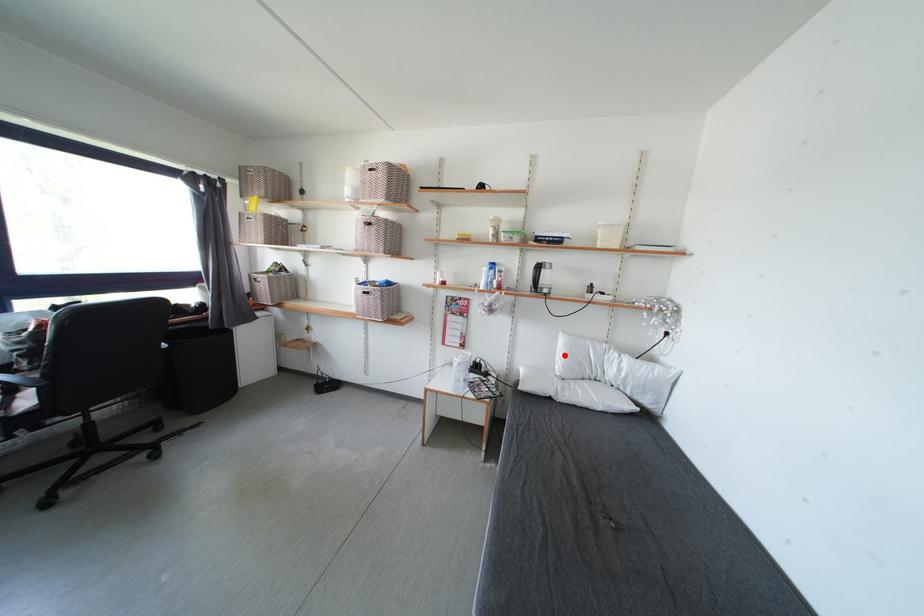
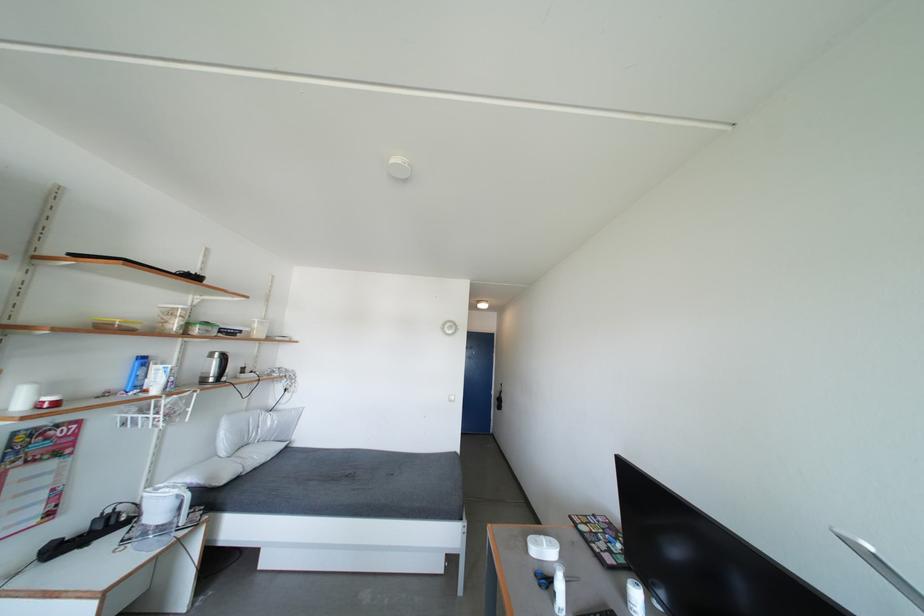
Find the pixel in the second image that matches the highlighted location in the first image.

(228, 439)